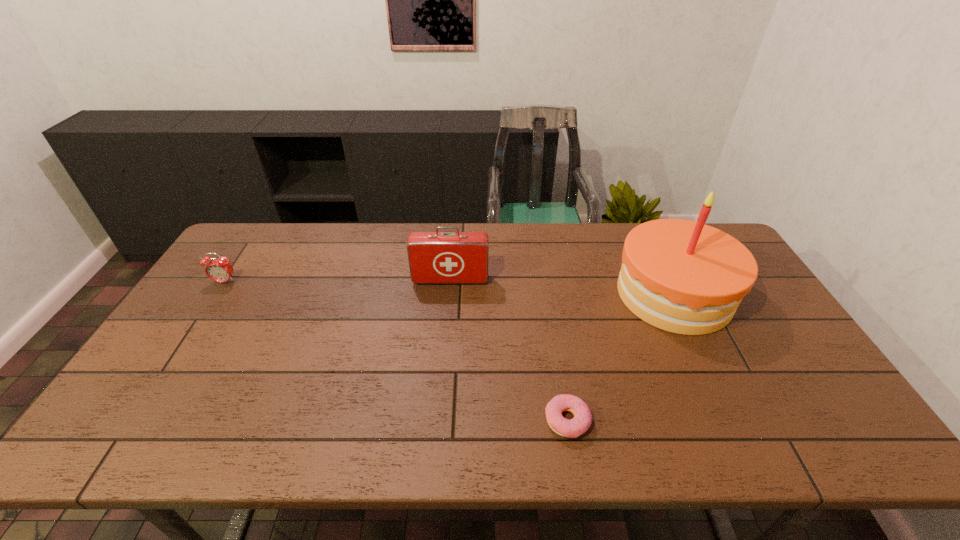
Image resolution: width=960 pixels, height=540 pixels. In order to click on free location that satisfies the following two spatial constraints: 1. on the side of the rightmost object with the first aid cross symbol; 2. on the left side of the second object from left to right in this screenshot , I will do `click(449, 294)`.

I want to click on free spot that satisfies the following two spatial constraints: 1. on the side of the second object from left to right with the first aid cross symbol; 2. on the right side of the shortest object, so click(440, 420).

Image resolution: width=960 pixels, height=540 pixels. I want to click on vacant space that satisfies the following two spatial constraints: 1. on the face of the tallest object; 2. on the left side of the alarm clock, so click(217, 294).